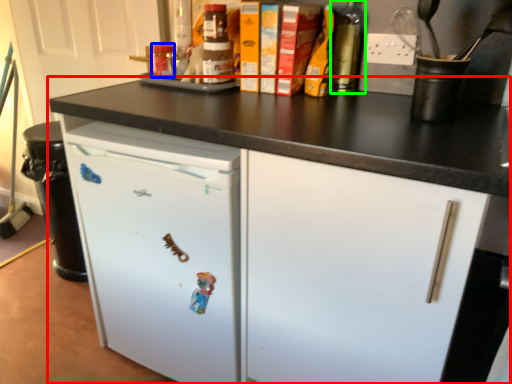
Question: Which object is positioned farthest from cabinetry (highlighted by a red box)? Select from bottle (highlighted by a blue box) and bottle (highlighted by a green box).

Choices:
 (A) bottle
 (B) bottle

Answer: (A)